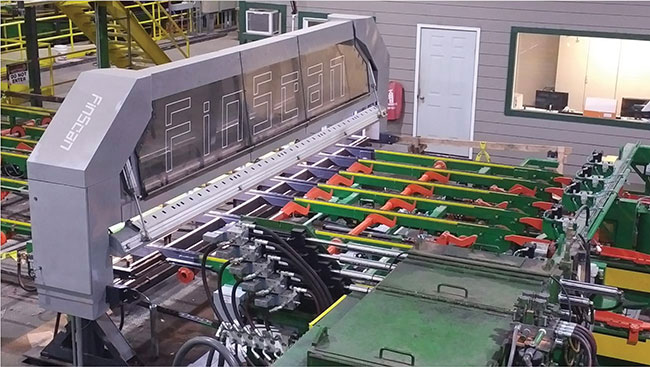
Locate an element on the screen. This screenshot has width=650, height=367. floor is located at coordinates (175, 333), (16, 313).